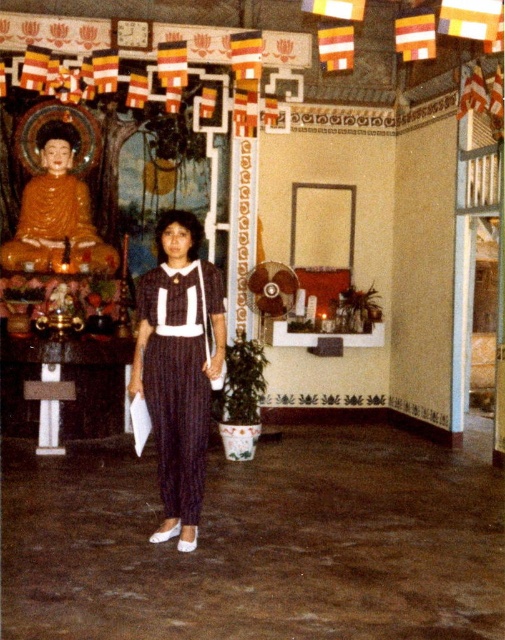
Question: Is striped fabric dress at center to the right of shiny gold statue at left from the viewer's perspective?

Choices:
 (A) no
 (B) yes

Answer: (B)

Question: Does striped fabric dress at center lie in front of shiny gold statue at left?

Choices:
 (A) yes
 (B) no

Answer: (A)

Question: Which of the following is the closest to the observer?

Choices:
 (A) (183, 330)
 (B) (38, 250)

Answer: (A)

Question: Which object appears farthest from the camera in this image?

Choices:
 (A) striped fabric dress at center
 (B) shiny gold statue at left

Answer: (B)

Question: Which of the following is the closest to the observer?

Choices:
 (A) (147, 323)
 (B) (81, 189)

Answer: (A)

Question: Does striped fabric dress at center appear on the left side of shiny gold statue at left?

Choices:
 (A) yes
 (B) no

Answer: (B)